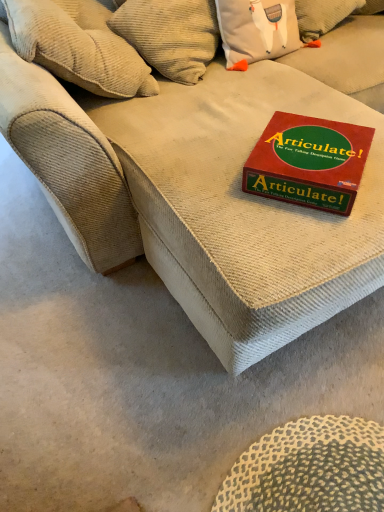
Locate an element on the screen. This screenshot has width=384, height=512. empty space that is ontop of red cardboard game box at center (from a real-world perspective) is located at coordinates (313, 146).